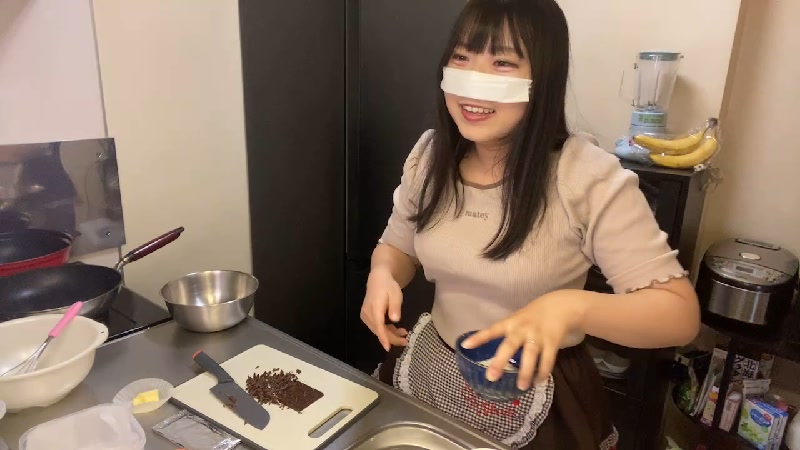
Where is `cutting board`? cutting board is located at coordinates (285, 421).